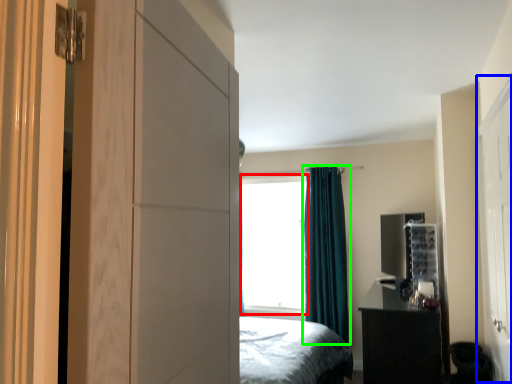
Question: Estimate the real-world distances between objects in this image. Which object is closer to window screen (highlighted by a red box), screen door (highlighted by a blue box) or curtain (highlighted by a green box)?

Choices:
 (A) screen door
 (B) curtain

Answer: (B)